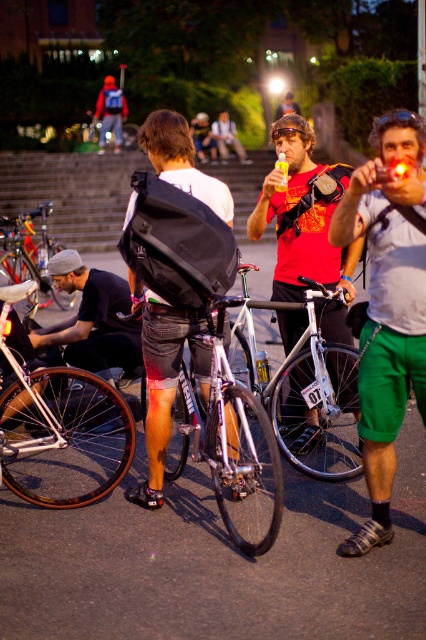
You are a photographer at the event and want to take a photo of the shiny orange rimmed bicycle at center without the matte black backpack at center blocking it. What should you do?

Move forward to get closer to the shiny orange rimmed bicycle at center so that the matte black backpack at center is no longer in front of it, since the matte black backpack at center is closer to the viewer than the bicycle.

Looking at this image, you are standing at the point with coordinates point [118,278] and want to walk to the point with coordinates point [419,234]. According to the image, is the destination point in front of or behind you?

The point [419,234] is in front of point [118,278], so the destination point is in front of you.